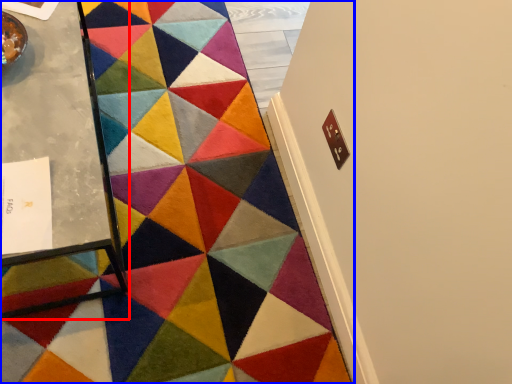
Question: Which of the following is the farthest to the observer, table (highlighted by a red box) or mat (highlighted by a blue box)?

Choices:
 (A) table
 (B) mat

Answer: (B)